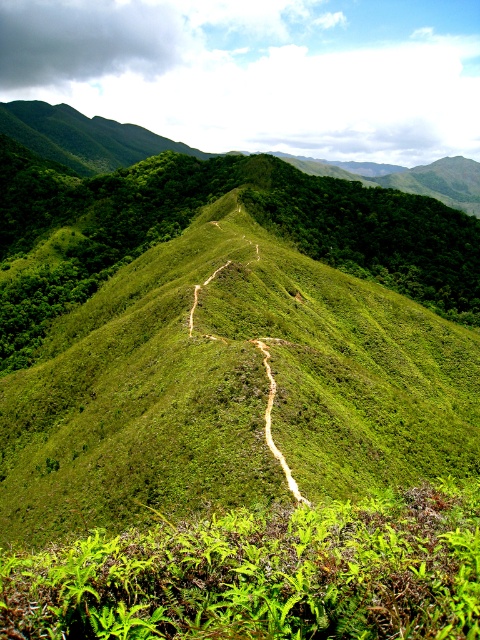
Question: Does green leafy vegetation at center have a larger size compared to dirt path at center?

Choices:
 (A) no
 (B) yes

Answer: (B)

Question: Which object appears farthest from the camera in this image?

Choices:
 (A) green leafy ferns at center
 (B) dirt path at center
 (C) green grassy hill at upper left
 (D) green leafy vegetation at center

Answer: (C)

Question: Which object is farther from the camera taking this photo?

Choices:
 (A) dirt path at center
 (B) green leafy ferns at center
 (C) green leafy vegetation at center
 (D) green grassy hill at upper left

Answer: (D)

Question: Is green leafy vegetation at center to the left of dirt path at center from the viewer's perspective?

Choices:
 (A) no
 (B) yes

Answer: (B)

Question: Which point is closer to the camera?

Choices:
 (A) green grassy hill at upper left
 (B) green leafy ferns at center

Answer: (B)

Question: In this image, where is green grassy hill at upper left located relative to dirt path at center?

Choices:
 (A) left
 (B) right

Answer: (B)